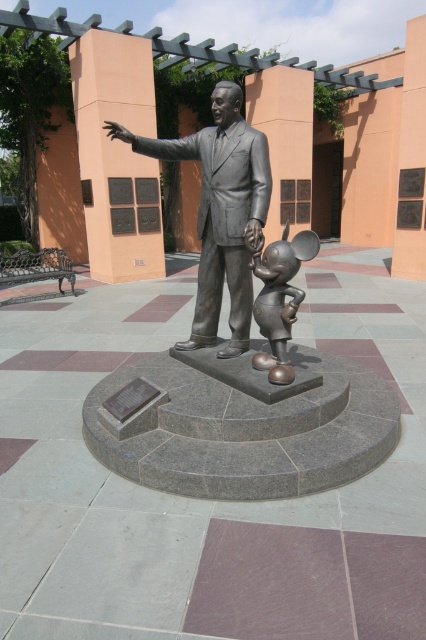
Consider the image. You are an art student analyzing the statue composition. Which figure, the polished bronze statue at center or the bronze mickey mouse at center, is placed higher up in the statue?

The polished bronze statue at center is positioned over the bronze mickey mouse at center, so it is placed higher up.